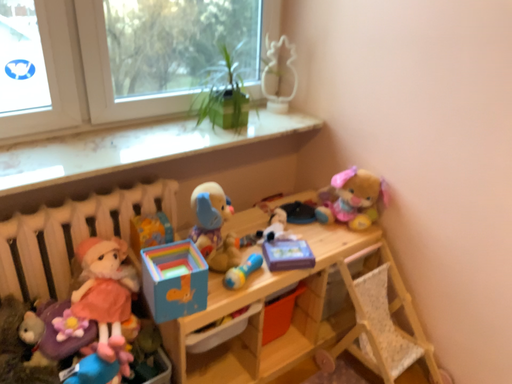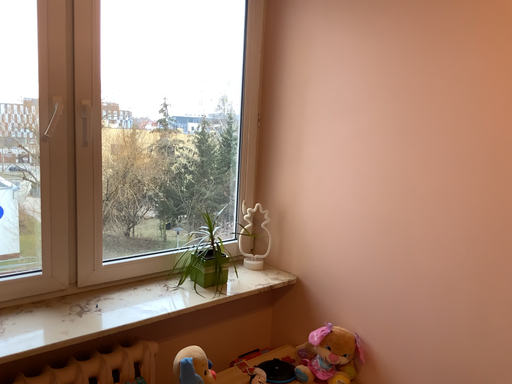
Question: How did the camera likely rotate when shooting the video?

Choices:
 (A) rotated upward
 (B) rotated downward

Answer: (A)